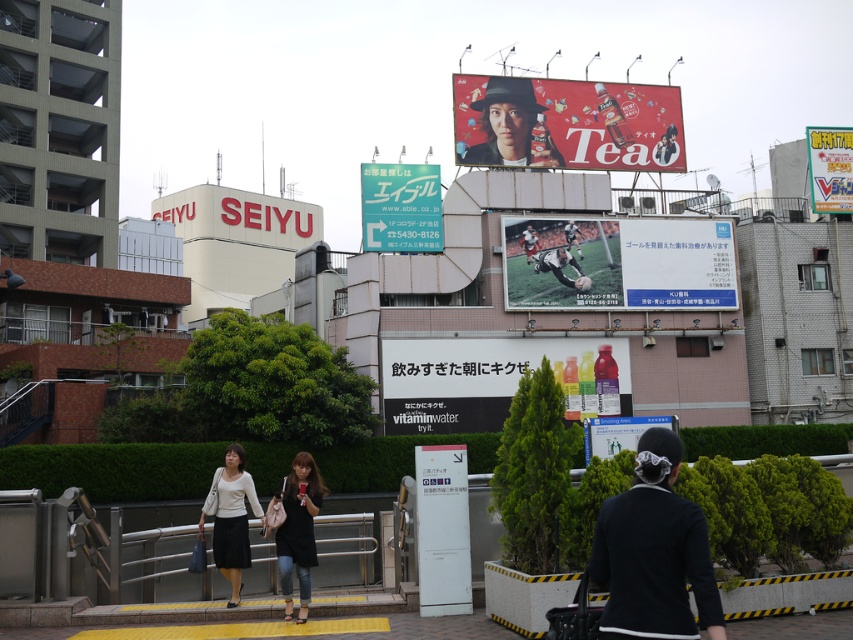
Question: Can you confirm if white matte blouse at center is smaller than black leather soccer player at center?

Choices:
 (A) no
 (B) yes

Answer: (B)

Question: Which point appears farthest from the camera in this image?

Choices:
 (A) (596, 147)
 (B) (404, 228)
 (C) (537, 262)
 (D) (503, 632)

Answer: (A)

Question: Is black fabric jacket at lower right behind matte black hat at upper center?

Choices:
 (A) no
 (B) yes

Answer: (A)

Question: Based on their relative distances, which object is farther from the white plastic vitaminwater bottle at center?

Choices:
 (A) denim jeans at center
 (B) white matte blouse at center

Answer: (A)

Question: Can you confirm if white plastic sign at center is bigger than black leather soccer player at center?

Choices:
 (A) yes
 (B) no

Answer: (A)

Question: Which is nearer to the white matte blouse at center?

Choices:
 (A) dark skin soccer player at center
 (B) matte black hat at upper center
 (C) green plastic sign at center

Answer: (C)